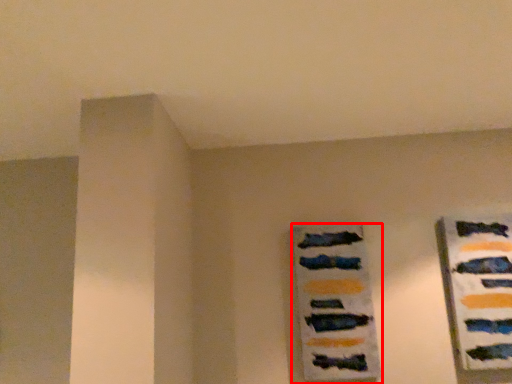
Question: From the image's perspective, what is the correct spatial positioning of picture frame (annotated by the red box) in reference to design?

Choices:
 (A) above
 (B) below

Answer: (B)